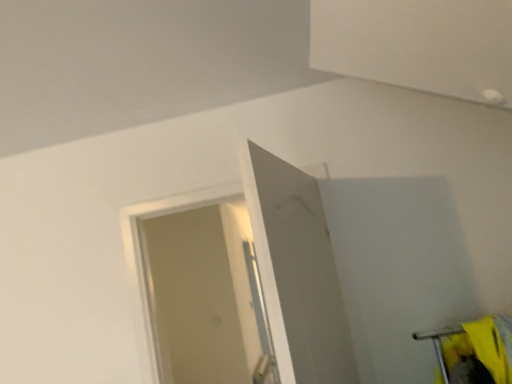
What do you see at coordinates (297, 271) in the screenshot? I see `white matte screen door at center` at bounding box center [297, 271].

Find the location of a particular element. The image size is (512, 384). white matte screen door at center is located at coordinates (297, 271).

Find the location of a particular element. The width and height of the screenshot is (512, 384). white matte screen door at center is located at coordinates (297, 271).